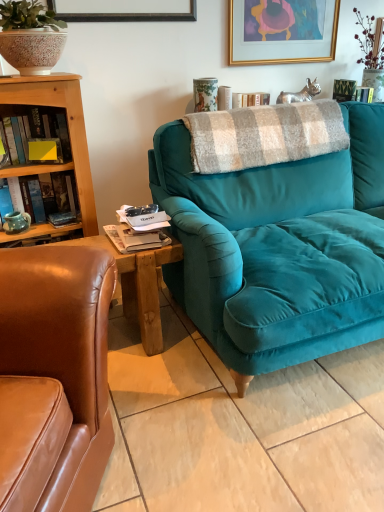
Question: Could you tell me if teal matte mug at left, which is counted as the second book, starting from the top, is facing yellow matte sticky note at left, the second book in the bottom-to-top sequence?

Choices:
 (A) yes
 (B) no

Answer: (B)

Question: Considering the relative sizes of teal matte mug at left, which is counted as the second book, starting from the top, and yellow matte sticky note at left, the first book in the top-to-bottom sequence, in the image provided, is teal matte mug at left, which is counted as the second book, starting from the top, taller than yellow matte sticky note at left, the first book in the top-to-bottom sequence,?

Choices:
 (A) yes
 (B) no

Answer: (B)

Question: From the image's perspective, does teal matte mug at left, which is counted as the second book, starting from the top, appear lower than yellow matte sticky note at left, the first book in the top-to-bottom sequence?

Choices:
 (A) no
 (B) yes

Answer: (B)

Question: Is teal matte mug at left, acting as the first book starting from the bottom, looking in the opposite direction of yellow matte sticky note at left, the second book in the bottom-to-top sequence?

Choices:
 (A) yes
 (B) no

Answer: (B)

Question: Is teal matte mug at left, acting as the first book starting from the bottom, thinner than yellow matte sticky note at left, the first book in the top-to-bottom sequence?

Choices:
 (A) no
 (B) yes

Answer: (B)

Question: From the image's perspective, relative to yellow matte sticky note at left, the first book in the top-to-bottom sequence, is teal velvet couch at center above or below?

Choices:
 (A) above
 (B) below

Answer: (B)

Question: From a real-world perspective, is teal velvet couch at center physically located above or below yellow matte sticky note at left, the first book in the top-to-bottom sequence?

Choices:
 (A) above
 (B) below

Answer: (B)

Question: Is teal velvet couch at center to the left or to the right of yellow matte sticky note at left, the first book in the top-to-bottom sequence, in the image?

Choices:
 (A) left
 (B) right

Answer: (B)

Question: Looking at their shapes, would you say teal velvet couch at center is wider or thinner than yellow matte sticky note at left, the first book in the top-to-bottom sequence?

Choices:
 (A) thin
 (B) wide

Answer: (B)

Question: Is plaid woolen blanket at center taller or shorter than matte ceramic mug at left?

Choices:
 (A) short
 (B) tall

Answer: (B)

Question: From a real-world perspective, relative to matte ceramic mug at left, is plaid woolen blanket at center vertically above or below?

Choices:
 (A) above
 (B) below

Answer: (A)

Question: Is point (196, 147) closer or farther from the camera than point (13, 224)?

Choices:
 (A) farther
 (B) closer

Answer: (B)

Question: Relative to matte ceramic mug at left, is plaid woolen blanket at center in front or behind?

Choices:
 (A) behind
 (B) front

Answer: (B)

Question: Is point (279, 38) closer or farther from the camera than point (39, 138)?

Choices:
 (A) farther
 (B) closer

Answer: (A)

Question: From a real-world perspective, is gold-framed artwork at upper center above or below yellow matte sticky note at left, the second book in the bottom-to-top sequence?

Choices:
 (A) below
 (B) above

Answer: (B)